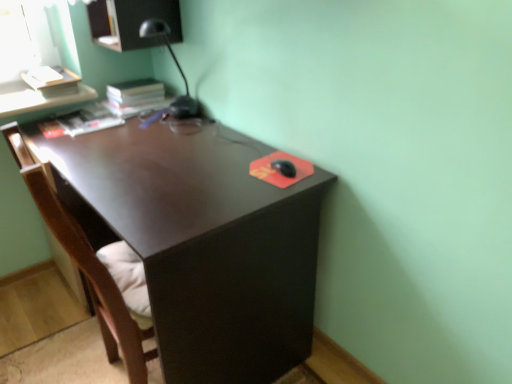
Question: Based on their sizes in the image, would you say matte black desk at center is bigger or smaller than brown wood swivel chair at left?

Choices:
 (A) big
 (B) small

Answer: (A)

Question: In terms of height, does matte black desk at center look taller or shorter compared to brown wood swivel chair at left?

Choices:
 (A) short
 (B) tall

Answer: (A)

Question: Considering their positions, is matte black desk at center located in front of or behind brown wood swivel chair at left?

Choices:
 (A) front
 (B) behind

Answer: (B)

Question: From the image's perspective, relative to matte black desk at center, is brown wood swivel chair at left above or below?

Choices:
 (A) below
 (B) above

Answer: (A)

Question: Considering the positions of brown wood swivel chair at left and matte black desk at center in the image, is brown wood swivel chair at left bigger or smaller than matte black desk at center?

Choices:
 (A) big
 (B) small

Answer: (B)

Question: In terms of width, does brown wood swivel chair at left look wider or thinner when compared to matte black desk at center?

Choices:
 (A) thin
 (B) wide

Answer: (A)

Question: Relative to matte black desk at center, is brown wood swivel chair at left in front or behind?

Choices:
 (A) behind
 (B) front

Answer: (B)